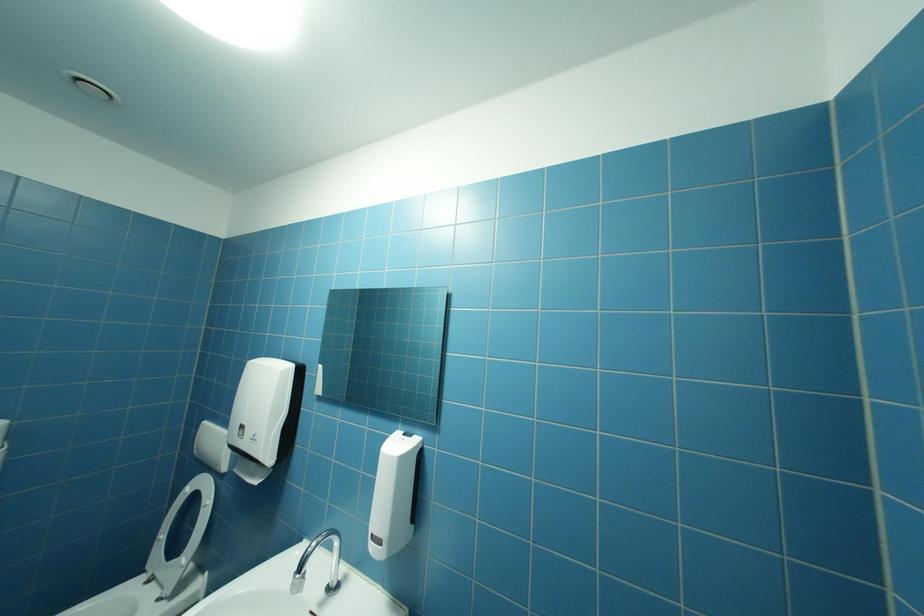
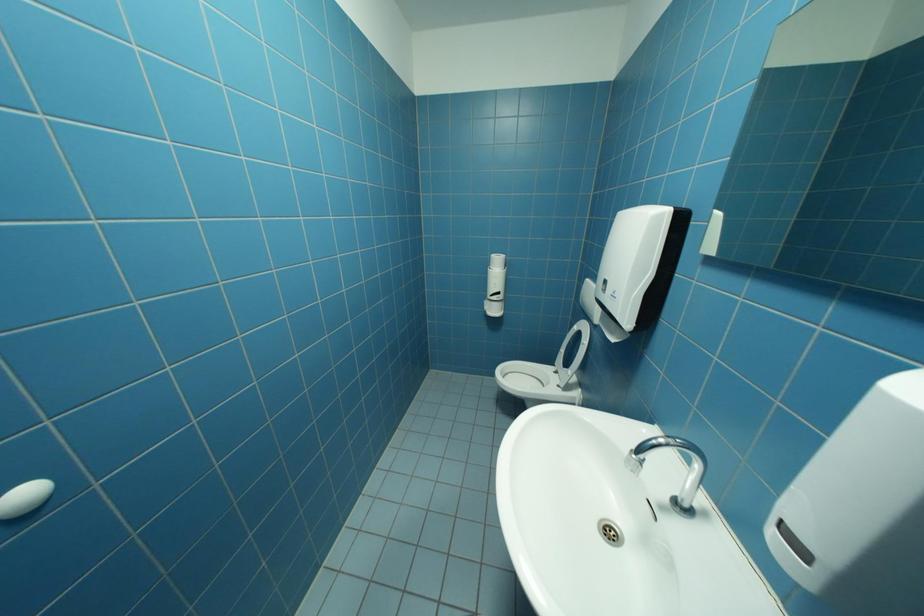
First-person continuous shooting, in which direction is the camera rotating?

The camera's rotation is toward left-down.